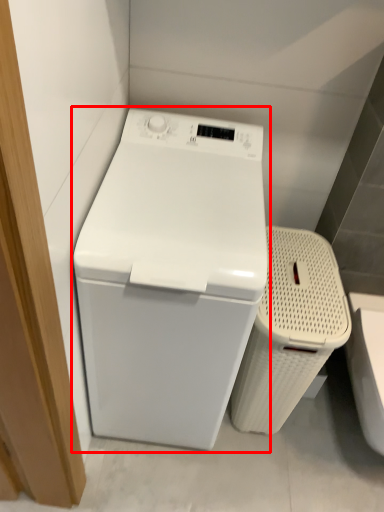
Question: From the image's perspective, what is the correct spatial relationship of washing machine (annotated by the red box) in relation to laundry basket?

Choices:
 (A) below
 (B) above

Answer: (B)